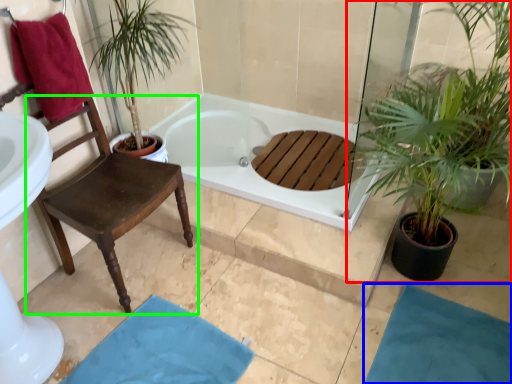
Question: Which object is positioned farthest from houseplant (highlighted by a red box)? Select from bath mat (highlighted by a blue box) and chair (highlighted by a green box).

Choices:
 (A) bath mat
 (B) chair

Answer: (B)